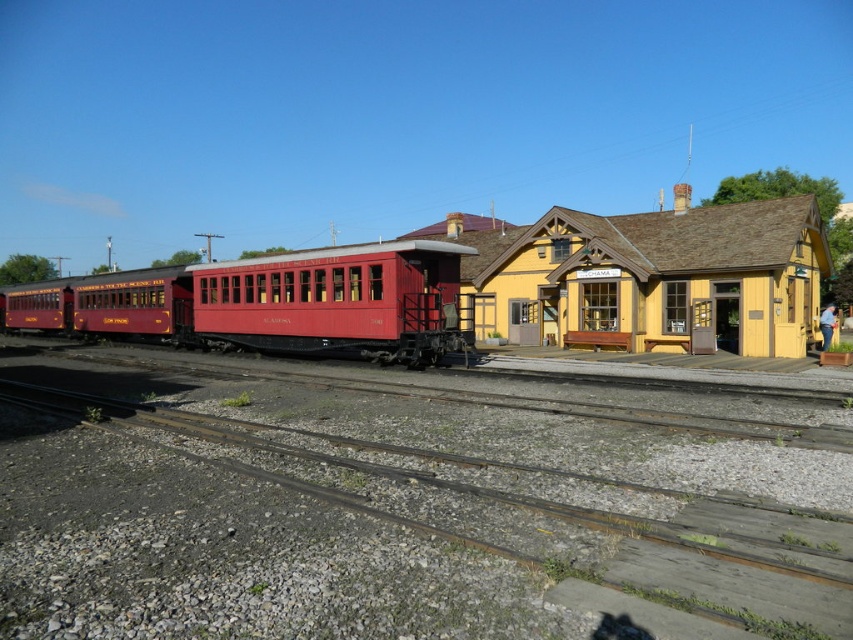
Question: Which point is farther from the camera taking this photo?

Choices:
 (A) (793, 451)
 (B) (398, 330)

Answer: (B)

Question: Observing the image, what is the correct spatial positioning of gravel at center in reference to matte red train car at center?

Choices:
 (A) right
 (B) left

Answer: (A)

Question: Which object appears farthest from the camera in this image?

Choices:
 (A) matte red train car at center
 (B) gravel at center

Answer: (A)

Question: Where is gravel at center located in relation to matte red train car at center in the image?

Choices:
 (A) below
 (B) above

Answer: (A)

Question: Is gravel at center above matte red train car at center?

Choices:
 (A) no
 (B) yes

Answer: (A)